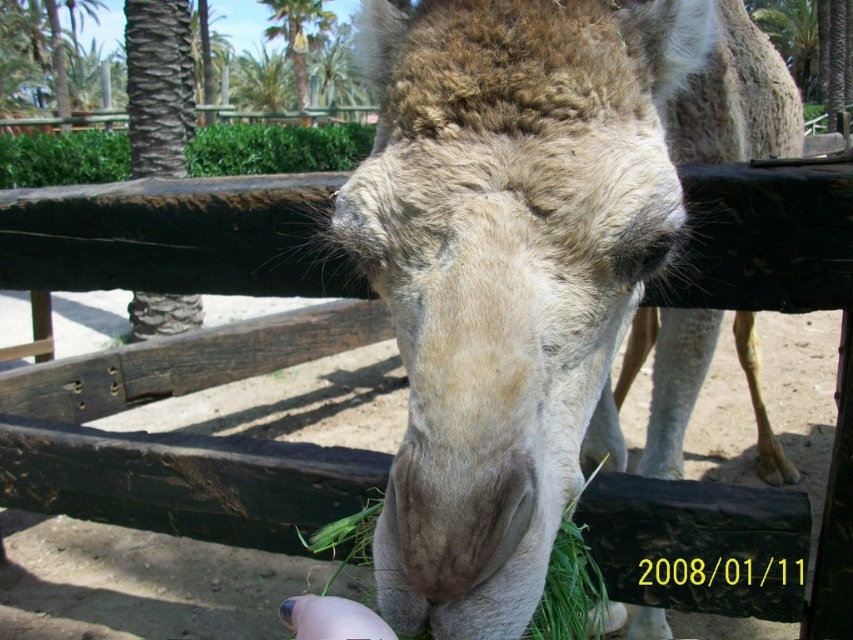
Which is more to the right, fuzzy beige camel at center or green leafy palm tree at upper center?

From the viewer's perspective, fuzzy beige camel at center appears more on the right side.

Does fuzzy beige camel at center lie behind green leafy palm tree at upper center?

No, fuzzy beige camel at center is in front of green leafy palm tree at upper center.

This screenshot has width=853, height=640. What do you see at coordinates (527, 257) in the screenshot?
I see `fuzzy beige camel at center` at bounding box center [527, 257].

Where is `fuzzy beige camel at center`? This screenshot has height=640, width=853. fuzzy beige camel at center is located at coordinates (527, 257).